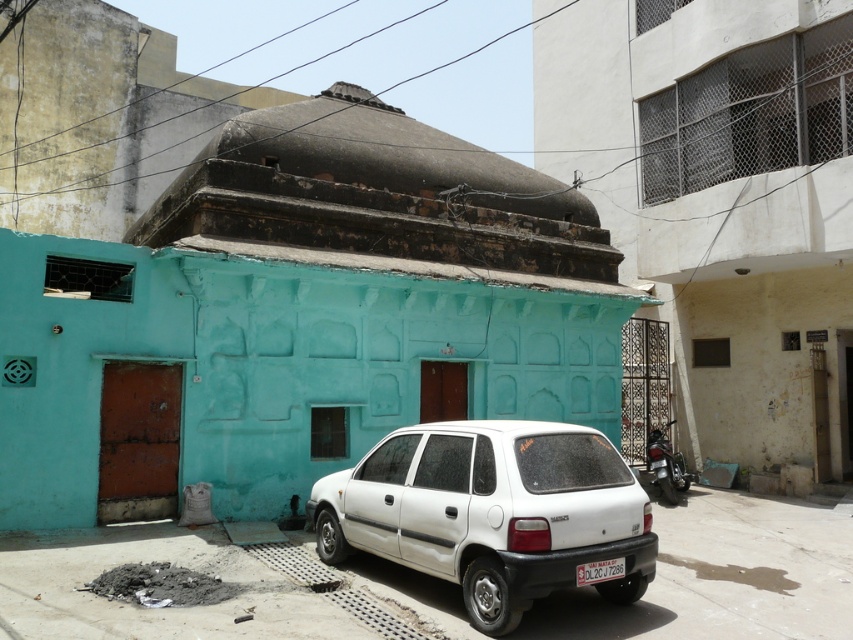
Question: Which point is closer to the camera?

Choices:
 (A) white plastic license plate at lower center
 (B) shiny metallic motorcycle at right

Answer: (A)

Question: Is white matte hatchback at center above white plastic license plate at lower center?

Choices:
 (A) yes
 (B) no

Answer: (A)

Question: Does shiny metallic motorcycle at right appear over white plastic license plate at lower center?

Choices:
 (A) yes
 (B) no

Answer: (B)

Question: Among these objects, which one is nearest to the camera?

Choices:
 (A) white plastic license plate at lower center
 (B) shiny metallic motorcycle at right
 (C) white matte hatchback at center

Answer: (C)

Question: Observing the image, what is the correct spatial positioning of white matte hatchback at center in reference to white plastic license plate at lower center?

Choices:
 (A) right
 (B) left

Answer: (B)

Question: Which point appears closest to the camera in this image?

Choices:
 (A) (677, 464)
 (B) (579, 576)
 (C) (331, 531)

Answer: (B)